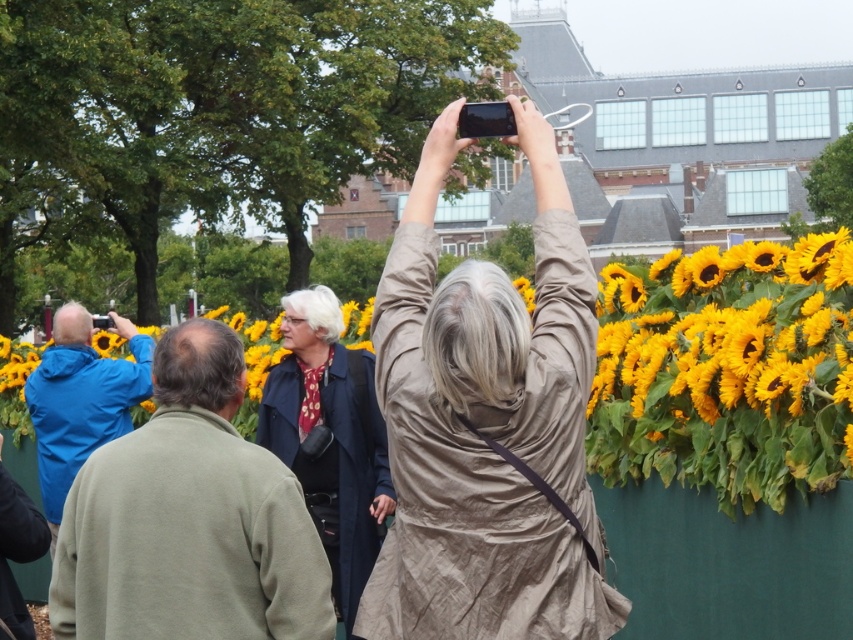
Does matte beige dress at center have a smaller size compared to dark blue coat at center?

No.

Who is more distant from viewer, (454, 534) or (387, 468)?

The point (387, 468) is behind.

Where is `matte beige dress at center`? This screenshot has height=640, width=853. matte beige dress at center is located at coordinates coord(486,422).

Can you confirm if matte blue jacket at left is positioned below dark blue coat at center?

Actually, matte blue jacket at left is above dark blue coat at center.

Consider the image. Is matte blue jacket at left closer to camera compared to dark blue coat at center?

Yes.

Which is behind, point (201, 588) or point (315, 493)?

Point (315, 493)

You are a GUI agent. You are given a task and a screenshot of the screen. Output one action in this format:
    pyautogui.click(x=<x>, y=<y>)
    Task: Click on the matte blue jacket at left
    The height and width of the screenshot is (640, 853).
    Given the screenshot: What is the action you would take?
    pyautogui.click(x=189, y=518)

Is the position of matte beige dress at center more distant than that of matte blue jacket at left?

No, it is in front of matte blue jacket at left.

Is matte beige dress at center closer to camera compared to matte blue jacket at left?

Yes, it is in front of matte blue jacket at left.

Between point (495, 608) and point (280, 541), which one is positioned in front?

Positioned in front is point (495, 608).

Find the location of `matte beige dress at center`. matte beige dress at center is located at coordinates (486, 422).